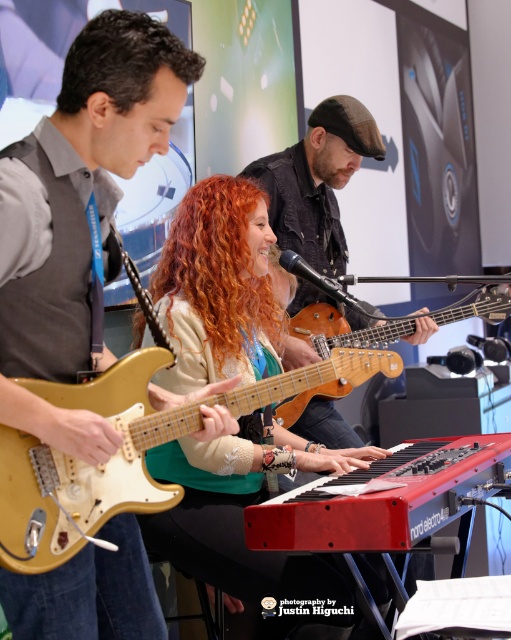
Who is more distant from viewer, (207, 326) or (203, 60)?

The point (207, 326) is behind.

Can you confirm if curly red hair at center is smaller than dark brown curly hair at upper left?

No.

The width and height of the screenshot is (511, 640). What are the coordinates of `curly red hair at center` in the screenshot? It's located at (217, 266).

The height and width of the screenshot is (640, 511). What are the coordinates of `curly red hair at center` in the screenshot? It's located at (217, 266).

Between matte gold guitar at center and dark brown curly hair at upper left, which one is positioned lower?

matte gold guitar at center

Who is more forward, (x=230, y=452) or (x=79, y=49)?

Point (x=79, y=49)

Locate an element on the screen. The height and width of the screenshot is (640, 511). matte gold guitar at center is located at coordinates (243, 524).

Is the position of matte gold guitar at center more distant than that of curly red hair at center?

That is False.

Does matte gold guitar at center appear under curly red hair at center?

Yes.

Who is more distant from viewer, (237, 548) or (178, 220)?

The point (178, 220) is behind.

Where is `matte gold guitar at center`? This screenshot has width=511, height=640. matte gold guitar at center is located at coordinates (243, 524).